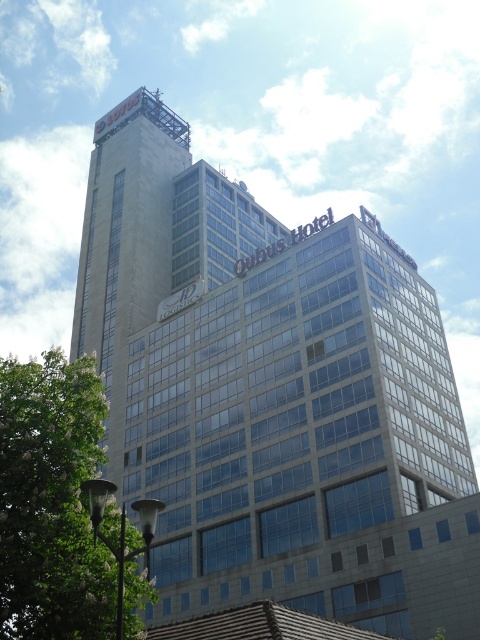
Does green leafy tree at lower left appear under silver metallic lamp post at lower left?

Incorrect, green leafy tree at lower left is not positioned below silver metallic lamp post at lower left.

How much distance is there between green leafy tree at lower left and silver metallic lamp post at lower left?

A distance of 4.27 meters exists between green leafy tree at lower left and silver metallic lamp post at lower left.

Where is `green leafy tree at lower left`? This screenshot has height=640, width=480. green leafy tree at lower left is located at coordinates 51,500.

What are the coordinates of `green leafy tree at lower left` in the screenshot? It's located at (51, 500).

Who is taller, gray concrete building at center or green leafy tree at lower left?

With more height is gray concrete building at center.

Can you confirm if gray concrete building at center is shorter than green leafy tree at lower left?

No, gray concrete building at center is not shorter than green leafy tree at lower left.

Does point (307, 448) come in front of point (79, 600)?

No.

At what (x,y) coordinates should I click in order to perform the action: click on gray concrete building at center. Please return your answer as a coordinate pair (x, y). Looking at the image, I should click on (272, 394).

Is gray concrete building at center thinner than silver metallic lamp post at lower left?

No.

Can you confirm if gray concrete building at center is taller than silver metallic lamp post at lower left?

Yes, gray concrete building at center is taller than silver metallic lamp post at lower left.

Does point (184, 284) come in front of point (96, 477)?

No.

I want to click on gray concrete building at center, so click(272, 394).